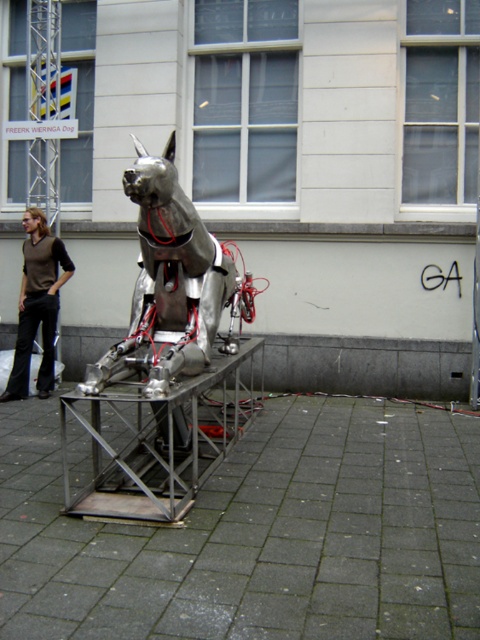
Looking at this image, you are standing at the entrance of the building and want to take a photo of the shiny metallic dog at center. According to the coordinates provided, where should you position yourself to ensure the dog is centered in your camera viewfinder?

According to the coordinates provided, the shiny metallic dog at center is located at point (169, 289). To center it in your camera viewfinder, position yourself directly in front of the entrance and adjust your angle so that the dog aligns with the center point of your viewfinder at those coordinates.